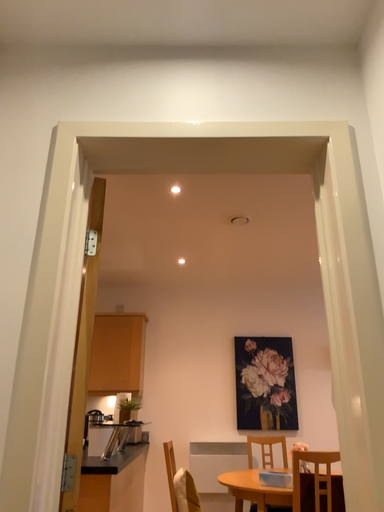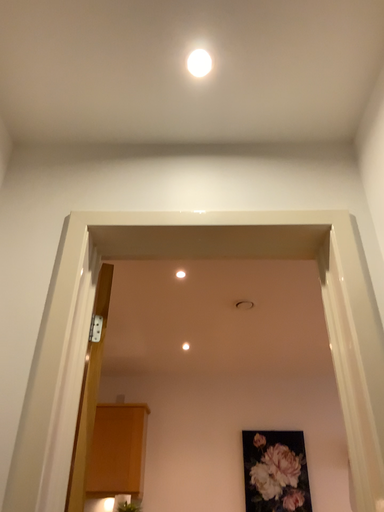
Question: Which way did the camera rotate in the video?

Choices:
 (A) rotated upward
 (B) rotated downward

Answer: (A)